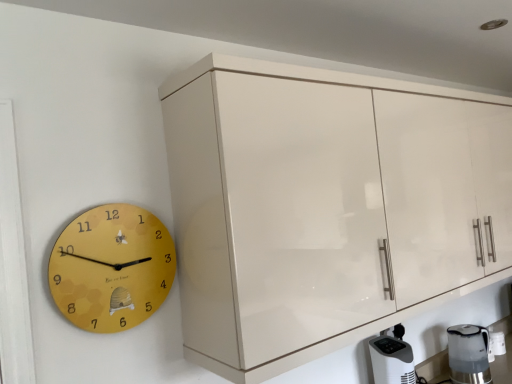
Question: From a real-world perspective, is satin silver kettle at lower right physically below glossy cream cabinet at upper right?

Choices:
 (A) yes
 (B) no

Answer: (A)

Question: Is satin silver kettle at lower right at the right side of glossy cream cabinet at upper right?

Choices:
 (A) yes
 (B) no

Answer: (A)

Question: From the image's perspective, is satin silver kettle at lower right beneath glossy cream cabinet at upper right?

Choices:
 (A) yes
 (B) no

Answer: (A)

Question: Would you consider satin silver kettle at lower right to be distant from glossy cream cabinet at upper right?

Choices:
 (A) yes
 (B) no

Answer: (B)

Question: From the image's perspective, does satin silver kettle at lower right appear higher than glossy cream cabinet at upper right?

Choices:
 (A) no
 (B) yes

Answer: (A)

Question: Is glossy cream cabinet at upper right inside the boundaries of satin silver kettle at lower right, or outside?

Choices:
 (A) outside
 (B) inside

Answer: (A)

Question: From the image's perspective, is glossy cream cabinet at upper right positioned above or below satin silver kettle at lower right?

Choices:
 (A) above
 (B) below

Answer: (A)

Question: Looking at the image, does glossy cream cabinet at upper right seem bigger or smaller compared to satin silver kettle at lower right?

Choices:
 (A) small
 (B) big

Answer: (B)

Question: From their relative heights in the image, would you say glossy cream cabinet at upper right is taller or shorter than satin silver kettle at lower right?

Choices:
 (A) tall
 (B) short

Answer: (A)

Question: Is glossy cream cabinet at upper right taller or shorter than white plastic air purifier at lower right?

Choices:
 (A) tall
 (B) short

Answer: (A)

Question: From the image's perspective, is glossy cream cabinet at upper right above or below white plastic air purifier at lower right?

Choices:
 (A) above
 (B) below

Answer: (A)

Question: Would you say glossy cream cabinet at upper right is to the left or to the right of white plastic air purifier at lower right in the picture?

Choices:
 (A) left
 (B) right

Answer: (B)

Question: Looking at the image, does glossy cream cabinet at upper right seem bigger or smaller compared to white plastic air purifier at lower right?

Choices:
 (A) big
 (B) small

Answer: (A)

Question: Would you say yellow matte clock at left is to the left or to the right of satin silver kettle at lower right in the picture?

Choices:
 (A) right
 (B) left

Answer: (B)

Question: From the image's perspective, is yellow matte clock at left located above or below satin silver kettle at lower right?

Choices:
 (A) above
 (B) below

Answer: (A)